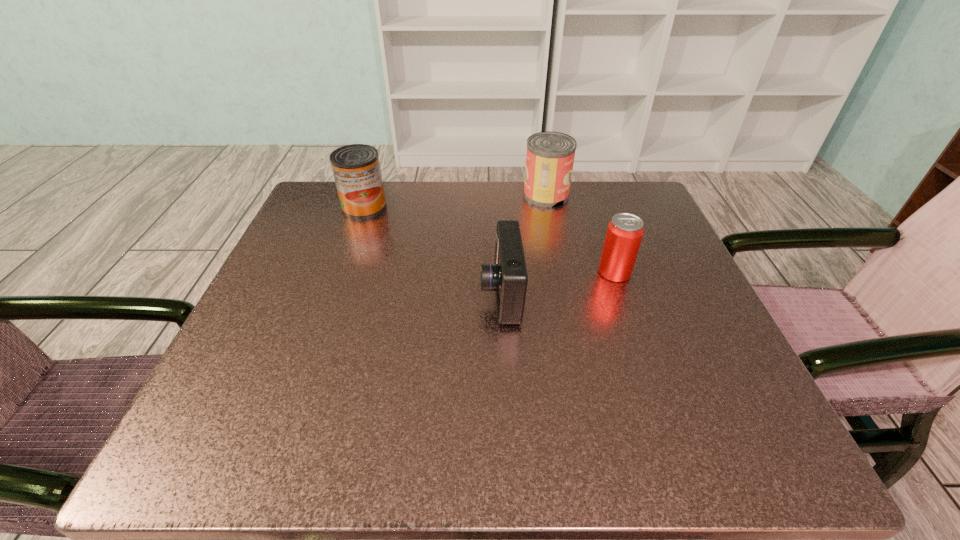
Locate which object ranks in proximity to the third object from right to left. Please provide its 2D coordinates. Your answer should be formatted as a tuple, i.e. [(x, y)], where the tuple contains the x and y coordinates of a point satisfying the conditions above.

[(624, 234)]

Locate which object is the third closest to the rightmost can. Please provide its 2D coordinates. Your answer should be formatted as a tuple, i.e. [(x, y)], where the tuple contains the x and y coordinates of a point satisfying the conditions above.

[(356, 168)]

Identify which can is the second closest to the second can from left to right. Please provide its 2D coordinates. Your answer should be formatted as a tuple, i.e. [(x, y)], where the tuple contains the x and y coordinates of a point satisfying the conditions above.

[(356, 168)]

I want to click on can that is the second closest to the rightmost can, so (356, 168).

Identify the location of vacant space that satisfies the following two spatial constraints: 1. on the back side of the leftmost can; 2. on the left side of the second can from left to right. The width and height of the screenshot is (960, 540). (369, 195).

The width and height of the screenshot is (960, 540). I want to click on vacant space that satisfies the following two spatial constraints: 1. on the front side of the second object from right to left; 2. on the left side of the rightmost can, so click(x=562, y=273).

Locate an element on the screen. This screenshot has width=960, height=540. vacant point that satisfies the following two spatial constraints: 1. on the front side of the second object from right to left; 2. on the right side of the rightmost object is located at coordinates (562, 273).